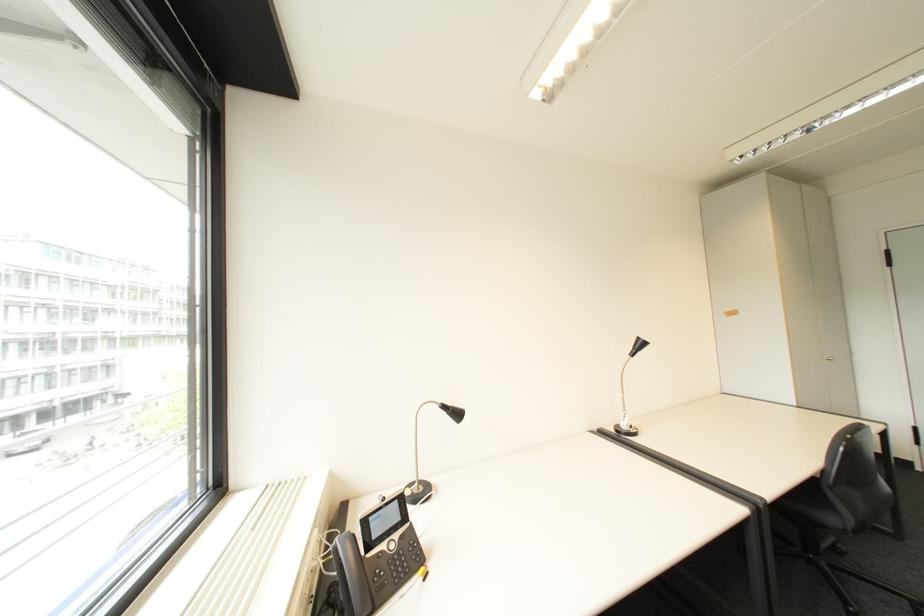
This screenshot has width=924, height=616. What do you see at coordinates (871, 318) in the screenshot?
I see `the door handle` at bounding box center [871, 318].